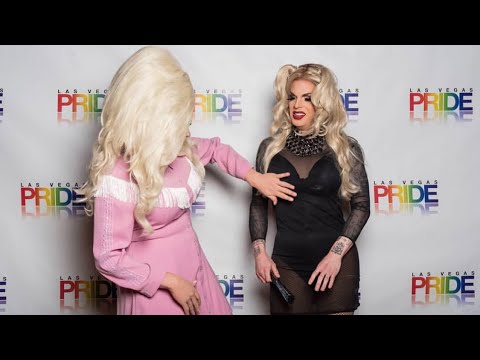
At what (x,y) coordinates should I click in order to perform the action: click on backdrop. Please return your answer as a coordinate pair (x, y). The width and height of the screenshot is (480, 360). Looking at the image, I should click on (388, 224).